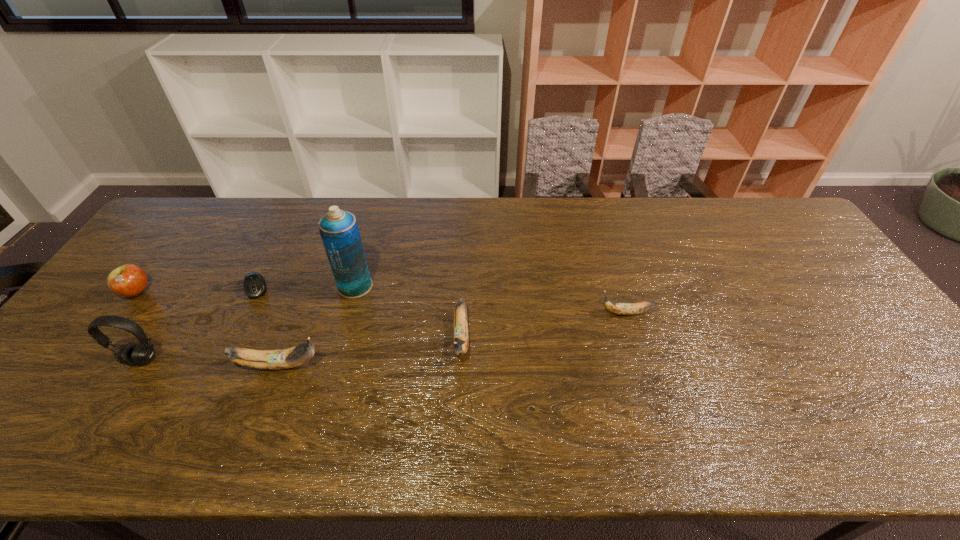
The image size is (960, 540). I want to click on free space that satisfies the following two spatial constraints: 1. at the stem of the rightmost banana; 2. on the front-facing side of the sixth shortest object, so click(x=640, y=360).

The width and height of the screenshot is (960, 540). I want to click on vacant space that satisfies the following two spatial constraints: 1. at the stem of the shortest banana; 2. on the front-facing side of the headset, so click(640, 360).

This screenshot has width=960, height=540. Identify the location of vacant space that satisfies the following two spatial constraints: 1. at the stem of the second object from right to left; 2. at the stem of the third tallest object. (460, 365).